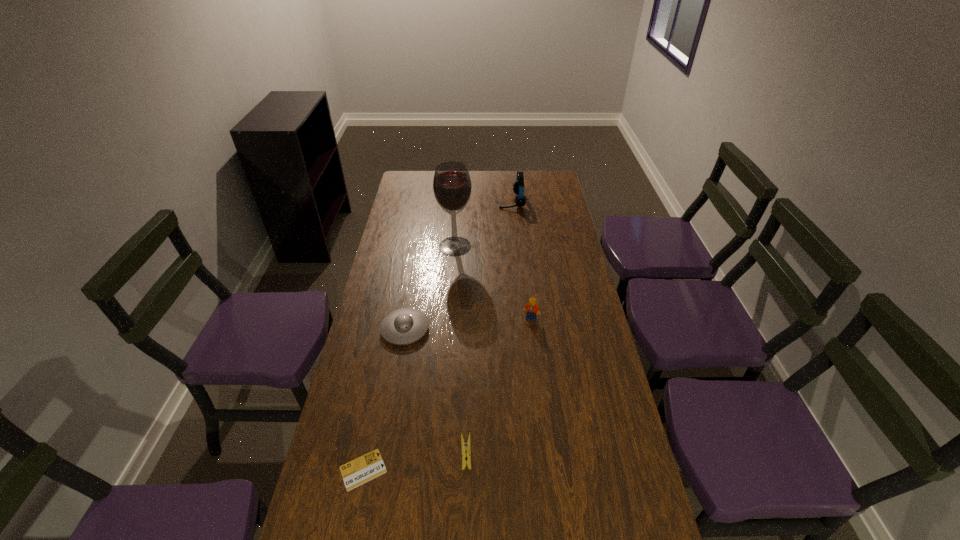
In order to click on vacant region at the right edge of the desktop in this screenshot , I will do `click(600, 455)`.

Identify the location of empty location between the fourth tallest object and the farthest object. (458, 265).

At what (x,y) coordinates should I click in order to perform the action: click on blank region between the clothespin and the alcohol. Please return your answer as a coordinate pair (x, y). Image resolution: width=960 pixels, height=540 pixels. Looking at the image, I should click on (461, 349).

This screenshot has height=540, width=960. In order to click on vacant area between the saucer and the Lego in this screenshot , I will do `click(468, 324)`.

I want to click on empty location between the Lego and the saucer, so click(468, 324).

Locate an element on the screen. The image size is (960, 540). free space between the clothespin and the shortest object is located at coordinates (415, 461).

Where is `unoccupied area between the tallest object and the identity card`? unoccupied area between the tallest object and the identity card is located at coordinates (409, 358).

Find the location of a particular element. Image resolution: width=960 pixels, height=540 pixels. vacant space in between the saucer and the second tallest object is located at coordinates (458, 265).

At what (x,y) coordinates should I click in order to perform the action: click on free area in between the alcohol and the headset. Please return your answer as a coordinate pair (x, y). This screenshot has height=540, width=960. Looking at the image, I should click on (484, 224).

Locate an element on the screen. vacant area that lies between the second shortest object and the farthest object is located at coordinates (489, 327).